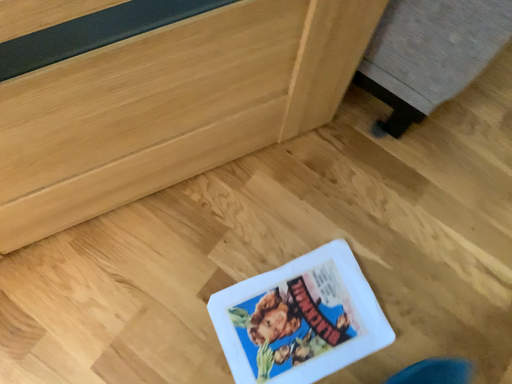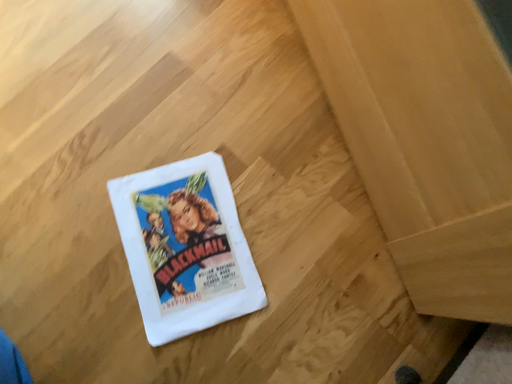
Question: Which way did the camera rotate in the video?

Choices:
 (A) rotated upward
 (B) rotated downward

Answer: (A)